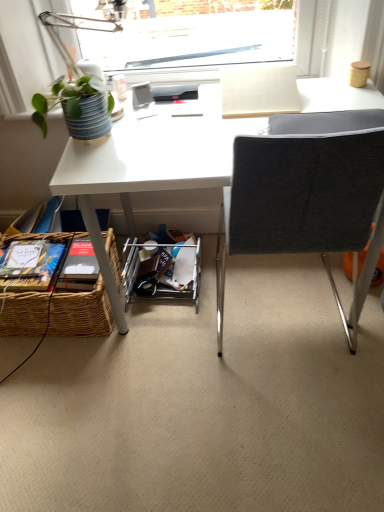
Question: Considering the relative sizes of woven brown picnic basket at lower left and dark gray fabric chair at center in the image provided, is woven brown picnic basket at lower left taller than dark gray fabric chair at center?

Choices:
 (A) yes
 (B) no

Answer: (B)

Question: Considering the relative positions of woven brown picnic basket at lower left and dark gray fabric chair at center in the image provided, is woven brown picnic basket at lower left to the right of dark gray fabric chair at center from the viewer's perspective?

Choices:
 (A) no
 (B) yes

Answer: (A)

Question: Does woven brown picnic basket at lower left have a larger size compared to dark gray fabric chair at center?

Choices:
 (A) no
 (B) yes

Answer: (A)

Question: From a real-world perspective, is woven brown picnic basket at lower left located beneath dark gray fabric chair at center?

Choices:
 (A) no
 (B) yes

Answer: (B)

Question: Can you see woven brown picnic basket at lower left touching dark gray fabric chair at center?

Choices:
 (A) yes
 (B) no

Answer: (B)

Question: From a real-world perspective, is woven brown picnic basket at lower left on dark gray fabric chair at center?

Choices:
 (A) yes
 (B) no

Answer: (B)

Question: Can you confirm if green matte plant at upper left is smaller than dark gray fabric chair at center?

Choices:
 (A) yes
 (B) no

Answer: (A)

Question: Would you say dark gray fabric chair at center is part of green matte plant at upper left's contents?

Choices:
 (A) yes
 (B) no

Answer: (B)

Question: Can you confirm if green matte plant at upper left is positioned to the right of dark gray fabric chair at center?

Choices:
 (A) yes
 (B) no

Answer: (B)

Question: Is green matte plant at upper left bigger than dark gray fabric chair at center?

Choices:
 (A) yes
 (B) no

Answer: (B)

Question: Is green matte plant at upper left shorter than dark gray fabric chair at center?

Choices:
 (A) no
 (B) yes

Answer: (B)

Question: Is green matte plant at upper left not inside dark gray fabric chair at center?

Choices:
 (A) no
 (B) yes

Answer: (B)

Question: Could you tell me if matte white table lamp at upper left is facing green matte plant at upper left?

Choices:
 (A) yes
 (B) no

Answer: (A)